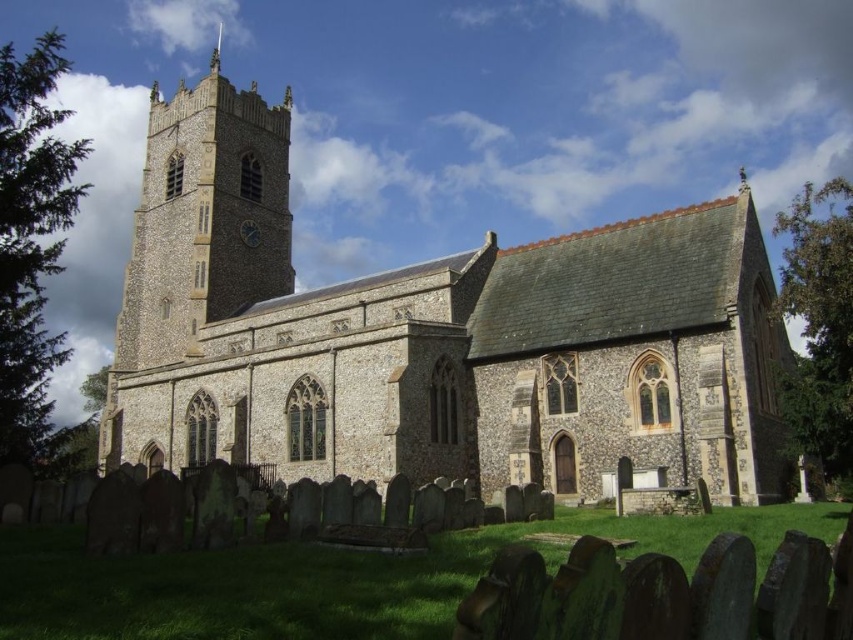
Question: Which is farther from the dark brown wooden clock at upper center?

Choices:
 (A) silver metallic spire at upper center
 (B) beige stone clock tower at upper left

Answer: (A)

Question: Considering the real-world distances, which object is closest to the beige stone clock tower at upper left?

Choices:
 (A) stone church at center
 (B) dark brown wooden clock at upper center

Answer: (B)

Question: Does beige stone clock tower at upper left have a greater width compared to dark brown wooden clock at upper center?

Choices:
 (A) yes
 (B) no

Answer: (A)

Question: Is dark brown wooden clock at upper center wider than silver metallic spire at upper center?

Choices:
 (A) no
 (B) yes

Answer: (A)

Question: Among these points, which one is nearest to the camera?

Choices:
 (A) (393, 321)
 (B) (212, 60)
 (C) (252, 241)
 (D) (287, 260)

Answer: (A)

Question: Is beige stone clock tower at upper left positioned in front of dark brown wooden clock at upper center?

Choices:
 (A) yes
 (B) no

Answer: (A)